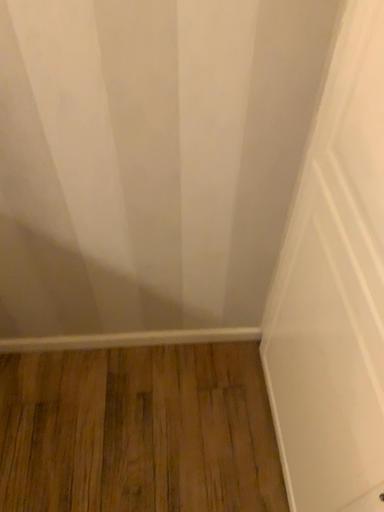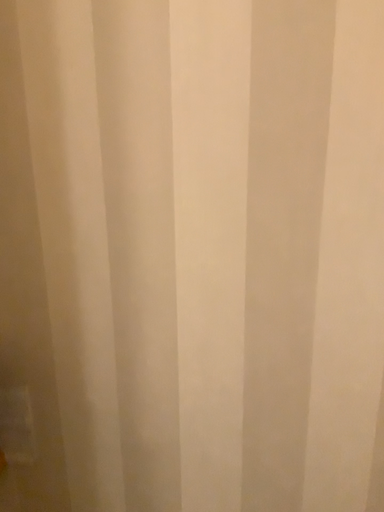
Question: Which way did the camera rotate in the video?

Choices:
 (A) rotated left
 (B) rotated right

Answer: (A)